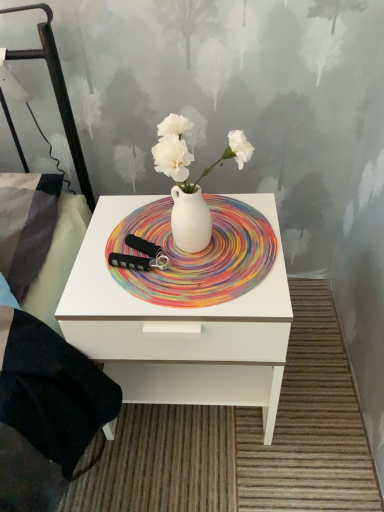
Question: From a real-world perspective, is white matte vase at center beneath white matte plate at center?

Choices:
 (A) yes
 (B) no

Answer: (B)

Question: Can you confirm if white matte vase at center is positioned to the right of white matte plate at center?

Choices:
 (A) no
 (B) yes

Answer: (B)

Question: Is white matte vase at center wider than white matte plate at center?

Choices:
 (A) yes
 (B) no

Answer: (B)

Question: From the image's perspective, would you say white matte vase at center is positioned over white matte plate at center?

Choices:
 (A) no
 (B) yes

Answer: (B)

Question: Does white matte vase at center lie behind white matte plate at center?

Choices:
 (A) yes
 (B) no

Answer: (B)

Question: Is white matte vase at center closer to the viewer compared to white matte plate at center?

Choices:
 (A) yes
 (B) no

Answer: (A)

Question: Is white glossy nightstand at center outside white matte plate at center?

Choices:
 (A) yes
 (B) no

Answer: (A)

Question: Is white glossy nightstand at center positioned in front of white matte plate at center?

Choices:
 (A) yes
 (B) no

Answer: (A)

Question: Does white glossy nightstand at center have a greater height compared to white matte plate at center?

Choices:
 (A) yes
 (B) no

Answer: (A)

Question: Does white glossy nightstand at center have a larger size compared to white matte plate at center?

Choices:
 (A) no
 (B) yes

Answer: (B)

Question: Is white glossy nightstand at center positioned with its back to white matte plate at center?

Choices:
 (A) yes
 (B) no

Answer: (B)

Question: Does white glossy nightstand at center have a lesser height compared to white matte plate at center?

Choices:
 (A) no
 (B) yes

Answer: (A)

Question: Is white matte vase at center in contact with white glossy nightstand at center?

Choices:
 (A) yes
 (B) no

Answer: (B)